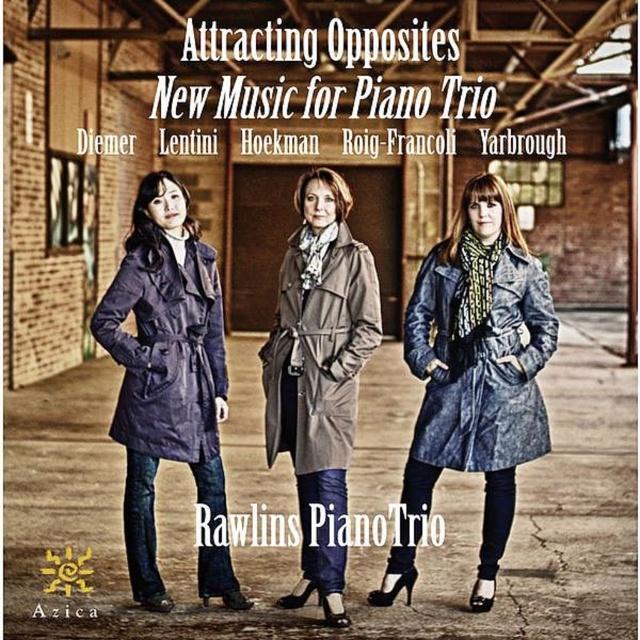
Between point (460, 454) and point (468, 467), which one is positioned behind?

The point (460, 454) is more distant.

Who is more forward, (396, 573) or (524, 442)?

Point (396, 573) is in front.

Which is behind, point (461, 458) or point (513, 433)?

The point (513, 433) is behind.

Locate an element on the screen. Image resolution: width=640 pixels, height=640 pixels. denim coat at center is located at coordinates (474, 376).

Between point (220, 368) and point (266, 358), which one is positioned in front?

Point (220, 368)

Does point (195, 429) come behind point (378, 298)?

No, (195, 429) is closer to viewer.

Between point (202, 275) and point (324, 307), which one is positioned in front?

Point (324, 307) is in front.

This screenshot has width=640, height=640. I want to click on navy blue leather coat at left, so click(x=164, y=349).

Looking at this image, is denim coat at center taller than navy blue leather coat at left?

Yes, denim coat at center is taller than navy blue leather coat at left.

The width and height of the screenshot is (640, 640). What do you see at coordinates (474, 376) in the screenshot?
I see `denim coat at center` at bounding box center [474, 376].

Where is `denim coat at center`? denim coat at center is located at coordinates (474, 376).